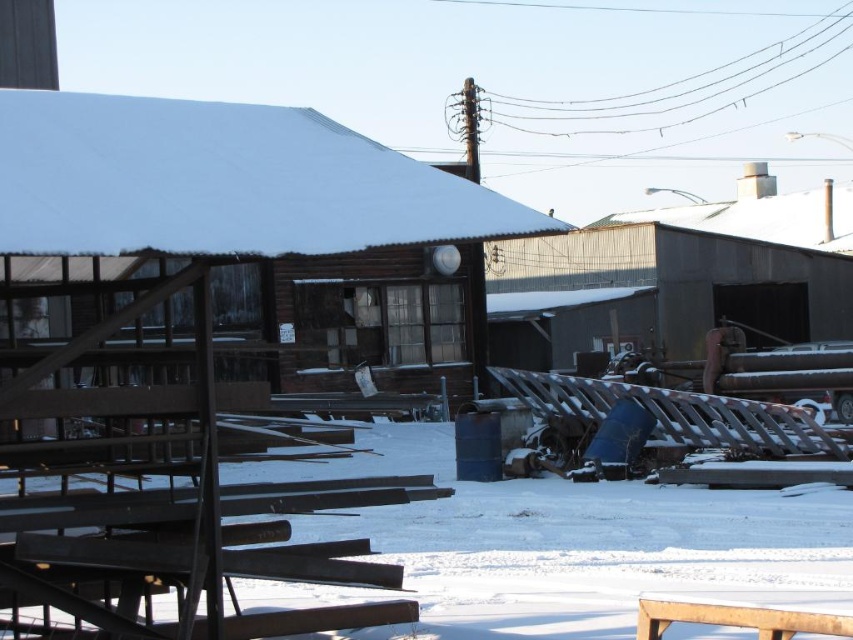
You are a delivery person trying to park your 2.5 meter wide truck in the snowy industrial area. The truck needs to pass between the white powdery snow at center and the brown wooden hut at center. Can the truck fit through the space between them?

The white powdery snow at center is wider than the brown wooden hut at center. Since the truck is 2.5 meters wide, it depends on the exact width of the snow and the hut. However, the description only states that the snow is wider, but doesn

You are a delivery drone that needs to land on the brown wooden hut at center. However, there is white powdery snow at center on top of it. Can you safely land there?

The white powdery snow at center is much taller than the brown wooden hut at center, so the snow might be too deep for the drone to land safely.

You are standing at the point closer to the camera in this snowy industrial area. Which point are you at, point (416, 516) or point (20, 140)?

You are at point (20, 140) because it is closer to the camera than point (416, 516).